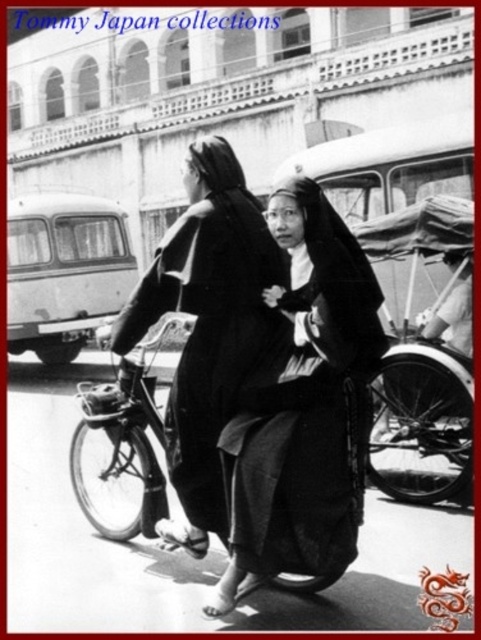
You are a delivery person who needs to choose between the wooden rickshaw at center and the metallic bicycle at center for transporting a large package. Which vehicle would allow you to see over the load more easily?

The metallic bicycle at center is taller than the wooden rickshaw at center, so you can see over the load more easily on the metallic bicycle at center.

You are a delivery person who needs to secure a package on the metallic bicycle at center. The smooth black robe at center is blocking access to the basket. Can you move the robe to access the basket?

The metallic bicycle at center is behind smooth black robe at center, so the robe is in front of the bicycle. To access the basket on the metallic bicycle at center, you would need to move the smooth black robe at center out of the way.